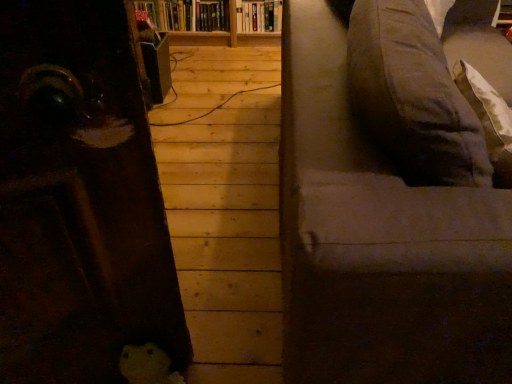
I want to click on hardcover book at upper center, which is the 1th book from right to left, so click(x=259, y=16).

You are a GUI agent. You are given a task and a screenshot of the screen. Output one action in this format:
    pyautogui.click(x=<x>, y=<y>)
    Task: Click on the dark gray fabric couch at right
    This screenshot has width=512, height=384.
    Given the screenshot: What is the action you would take?
    pyautogui.click(x=378, y=240)

What is the approximate width of hardcover book at upper center, which is the first book from left to right?

9.73 inches.

This screenshot has width=512, height=384. Identify the location of hardcover book at upper center, positioned as the 2th book in left-to-right order. (259, 16).

In the scene shown: Is dark gray fabric couch at right taller or shorter than hardcover book at upper center, which is the 1th book from right to left?

Clearly, dark gray fabric couch at right is taller compared to hardcover book at upper center, which is the 1th book from right to left.

Could you tell me if dark gray fabric couch at right is turned towards hardcover book at upper center, which is the 1th book from right to left?

No, dark gray fabric couch at right is not facing towards hardcover book at upper center, which is the 1th book from right to left.

Between dark gray fabric couch at right and hardcover book at upper center, positioned as the 2th book in left-to-right order, which one has smaller width?

With smaller width is hardcover book at upper center, positioned as the 2th book in left-to-right order.

From the image's perspective, is dark gray fabric couch at right on top of hardcover book at upper center, which is the 1th book from right to left?

Actually, dark gray fabric couch at right appears below hardcover book at upper center, which is the 1th book from right to left, in the image.

Is hardcover book at upper center, which is the 1th book from right to left, to the right of hardcover book at upper center, which is the first book from left to right, from the viewer's perspective?

Correct, you'll find hardcover book at upper center, which is the 1th book from right to left, to the right of hardcover book at upper center, which is the first book from left to right.

Considering the relative sizes of hardcover book at upper center, which is the 1th book from right to left, and hardcover book at upper center, which is the first book from left to right, in the image provided, is hardcover book at upper center, which is the 1th book from right to left, taller than hardcover book at upper center, which is the first book from left to right,?

No, hardcover book at upper center, which is the 1th book from right to left, is not taller than hardcover book at upper center, which is the first book from left to right.

Which is in front, point (259, 20) or point (213, 4)?

The point (213, 4) is closer to the camera.

Can you tell me how much hardcover book at upper center, which is the first book from left to right, and hardcover book at upper center, which is the 1th book from right to left, differ in facing direction?

The facing directions of hardcover book at upper center, which is the first book from left to right, and hardcover book at upper center, which is the 1th book from right to left, are 0.000422 degrees apart.

Find the location of `book lying on the left of hardcover book at upper center, which is the 1th book from right to left`. book lying on the left of hardcover book at upper center, which is the 1th book from right to left is located at coordinates (187, 14).

Which object is more forward, hardcover book at upper center, which is the second book from right to left, or hardcover book at upper center, positioned as the 2th book in left-to-right order?

Positioned in front is hardcover book at upper center, positioned as the 2th book in left-to-right order.

From the image's perspective, which is below, hardcover book at upper center, which is the second book from right to left, or hardcover book at upper center, positioned as the 2th book in left-to-right order?

hardcover book at upper center, positioned as the 2th book in left-to-right order.

Looking at this image, how different are the orientations of dark gray fabric couch at right and hardcover book at upper center, which is the first book from left to right, in degrees?

90.6 degrees.

How far apart are dark gray fabric couch at right and hardcover book at upper center, which is the first book from left to right?

dark gray fabric couch at right is 1.89 meters from hardcover book at upper center, which is the first book from left to right.

Which is correct: dark gray fabric couch at right is inside hardcover book at upper center, which is the first book from left to right, or outside of it?

dark gray fabric couch at right is not enclosed by hardcover book at upper center, which is the first book from left to right.

Is dark gray fabric couch at right closer to camera compared to hardcover book at upper center, which is the first book from left to right?

Yes, dark gray fabric couch at right is closer to the viewer.

Considering the positions of objects hardcover book at upper center, which is the second book from right to left, and dark gray fabric couch at right in the image provided, who is behind, hardcover book at upper center, which is the second book from right to left, or dark gray fabric couch at right?

hardcover book at upper center, which is the second book from right to left, is more distant.

From a real-world perspective, between hardcover book at upper center, which is the second book from right to left, and dark gray fabric couch at right, who is vertically higher?

dark gray fabric couch at right, from a real-world perspective.

Based on their positions, is hardcover book at upper center, which is the second book from right to left, located to the left or right of dark gray fabric couch at right?

From the image, it's evident that hardcover book at upper center, which is the second book from right to left, is to the left of dark gray fabric couch at right.

You are a GUI agent. You are given a task and a screenshot of the screen. Output one action in this format:
    pyautogui.click(x=<x>, y=<y>)
    Task: Click on the 2nd book to the left when counting from the dark gray fabric couch at right
    This screenshot has width=512, height=384.
    Given the screenshot: What is the action you would take?
    pyautogui.click(x=187, y=14)

Do you think hardcover book at upper center, positioned as the 2th book in left-to-right order, is within dark gray fabric couch at right, or outside of it?

hardcover book at upper center, positioned as the 2th book in left-to-right order, is outside dark gray fabric couch at right.

Are hardcover book at upper center, which is the 1th book from right to left, and dark gray fabric couch at right making contact?

No, hardcover book at upper center, which is the 1th book from right to left, is not making contact with dark gray fabric couch at right.

The height and width of the screenshot is (384, 512). There is a dark gray fabric couch at right. Find the location of `the 1st book above it (from the image's perspective)`. the 1st book above it (from the image's perspective) is located at coordinates (259, 16).

Which is behind, hardcover book at upper center, which is the 1th book from right to left, or dark gray fabric couch at right?

hardcover book at upper center, which is the 1th book from right to left, is further away from the camera.

This screenshot has width=512, height=384. In order to click on studio couch below the hardcover book at upper center, which is the 1th book from right to left (from the image's perspective) in this screenshot , I will do `click(378, 240)`.

Find the location of `book that is behind the hardcover book at upper center, positioned as the 2th book in left-to-right order`. book that is behind the hardcover book at upper center, positioned as the 2th book in left-to-right order is located at coordinates (187, 14).

Estimate the real-world distances between objects in this image. Which object is closer to dark gray fabric couch at right, hardcover book at upper center, which is the second book from right to left, or hardcover book at upper center, positioned as the 2th book in left-to-right order?

hardcover book at upper center, which is the second book from right to left, lies closer to dark gray fabric couch at right than the other object.

Estimate the real-world distances between objects in this image. Which object is closer to hardcover book at upper center, which is the first book from left to right, hardcover book at upper center, positioned as the 2th book in left-to-right order, or dark gray fabric couch at right?

hardcover book at upper center, positioned as the 2th book in left-to-right order.

When comparing their distances from dark gray fabric couch at right, does hardcover book at upper center, positioned as the 2th book in left-to-right order, or hardcover book at upper center, which is the first book from left to right, seem closer?

hardcover book at upper center, which is the first book from left to right, lies closer to dark gray fabric couch at right than the other object.

Estimate the real-world distances between objects in this image. Which object is further from hardcover book at upper center, which is the first book from left to right, dark gray fabric couch at right or hardcover book at upper center, positioned as the 2th book in left-to-right order?

Based on the image, dark gray fabric couch at right appears to be further to hardcover book at upper center, which is the first book from left to right.

Based on their spatial positions, is dark gray fabric couch at right or hardcover book at upper center, which is the first book from left to right, closer to hardcover book at upper center, which is the 1th book from right to left?

The object closer to hardcover book at upper center, which is the 1th book from right to left, is hardcover book at upper center, which is the first book from left to right.

Looking at the image, which one is located closer to hardcover book at upper center, positioned as the 2th book in left-to-right order, hardcover book at upper center, which is the first book from left to right, or dark gray fabric couch at right?

hardcover book at upper center, which is the first book from left to right.

Image resolution: width=512 pixels, height=384 pixels. Find the location of `book positioned between dark gray fabric couch at right and hardcover book at upper center, which is the second book from right to left, from near to far`. book positioned between dark gray fabric couch at right and hardcover book at upper center, which is the second book from right to left, from near to far is located at coordinates (259, 16).